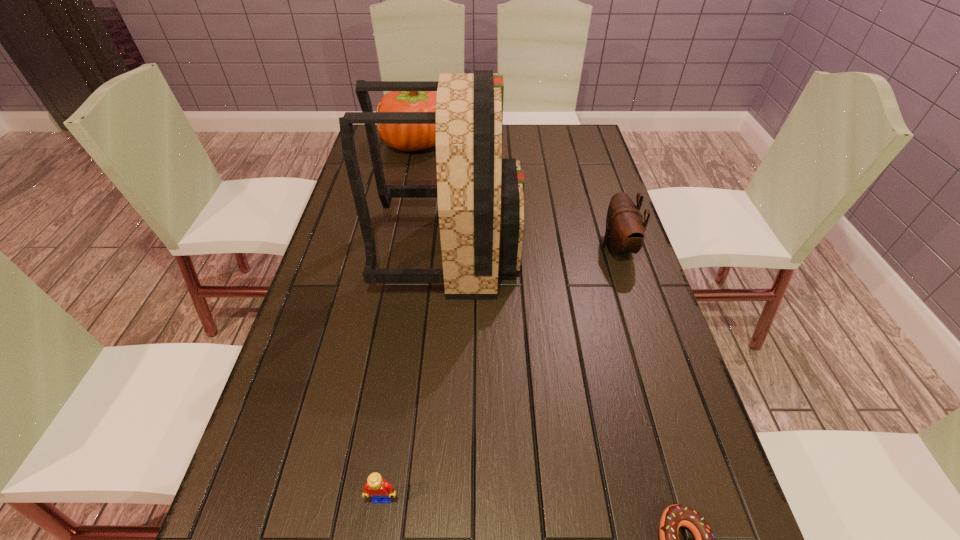
The width and height of the screenshot is (960, 540). In order to click on vacant space at the far right corner of the desktop in this screenshot , I will do `click(602, 156)`.

Find the location of a particular element. The height and width of the screenshot is (540, 960). unoccupied area between the Lego and the tallest object is located at coordinates (416, 373).

This screenshot has width=960, height=540. Find the location of `vacant space that's between the fourth farthest object and the backpack`. vacant space that's between the fourth farthest object and the backpack is located at coordinates pyautogui.click(x=416, y=373).

Where is `free space between the fourth tallest object and the tallest object`? The height and width of the screenshot is (540, 960). free space between the fourth tallest object and the tallest object is located at coordinates (416, 373).

Locate an element on the screen. Image resolution: width=960 pixels, height=540 pixels. free space between the backpack and the third tallest object is located at coordinates (534, 247).

Identify the location of free space between the second shortest object and the pumpkin. Image resolution: width=960 pixels, height=540 pixels. (399, 320).

Where is `free space between the third shortest object and the backpack`? This screenshot has width=960, height=540. free space between the third shortest object and the backpack is located at coordinates pos(534,247).

You are a GUI agent. You are given a task and a screenshot of the screen. Output one action in this format:
    pyautogui.click(x=<x>, y=<y>)
    Task: Click on the object that stands as the third closest to the second tallest object
    The width and height of the screenshot is (960, 540).
    Given the screenshot: What is the action you would take?
    pyautogui.click(x=378, y=489)

Identify which object is the third closest to the Lego. Please provide its 2D coordinates. Your answer should be formatted as a tuple, i.e. [(x, y)], where the tuple contains the x and y coordinates of a point satisfying the conditions above.

[(625, 230)]

What are the coordinates of `blank area in the image that satisfies the following two spatial constraints: 1. on the front face of the tallest object; 2. on the front-facing side of the Lego` in the screenshot? It's located at (431, 498).